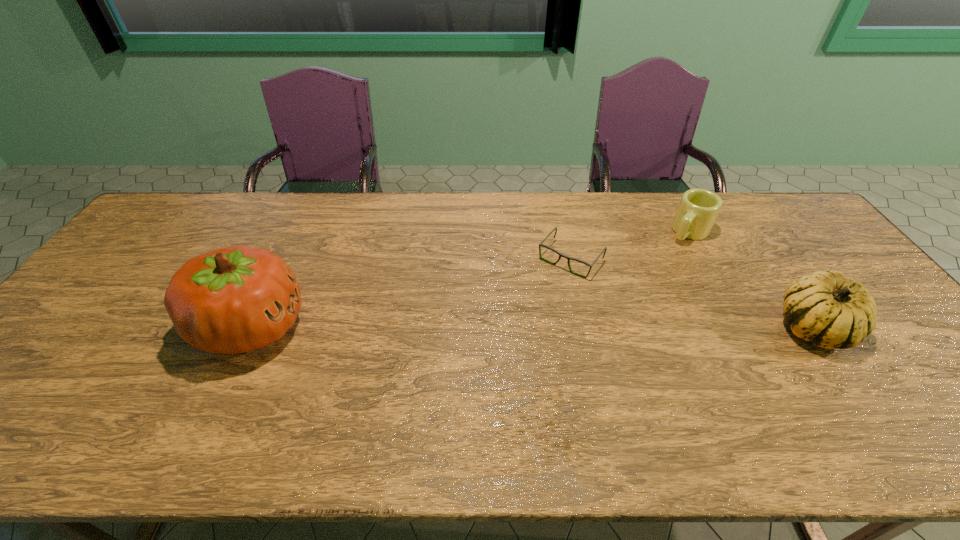
Locate an element on the screen. empty space that is in between the rightmost object and the second object from right to left is located at coordinates (751, 280).

You are a GUI agent. You are given a task and a screenshot of the screen. Output one action in this format:
    pyautogui.click(x=<x>, y=<y>)
    Task: Click on the unoccupied position between the tallest object and the shortest object
    
    Given the screenshot: What is the action you would take?
    pyautogui.click(x=411, y=293)

The height and width of the screenshot is (540, 960). I want to click on vacant area that lies between the second object from left to right and the leftmost object, so click(411, 293).

I want to click on the second closest object to the shortest object, so click(831, 311).

Select which object appears as the closest to the spectacles. Please provide its 2D coordinates. Your answer should be formatted as a tuple, i.e. [(x, y)], where the tuple contains the x and y coordinates of a point satisfying the conditions above.

[(698, 209)]

In order to click on vacant point that satisfies the following two spatial constraints: 1. on the front side of the gourd; 2. on the left side of the mug in this screenshot , I will do `click(741, 327)`.

What are the coordinates of `vacant position in the image that satisfies the following two spatial constraints: 1. on the front side of the rightmost object; 2. on the left side of the second object from left to right` in the screenshot? It's located at (586, 327).